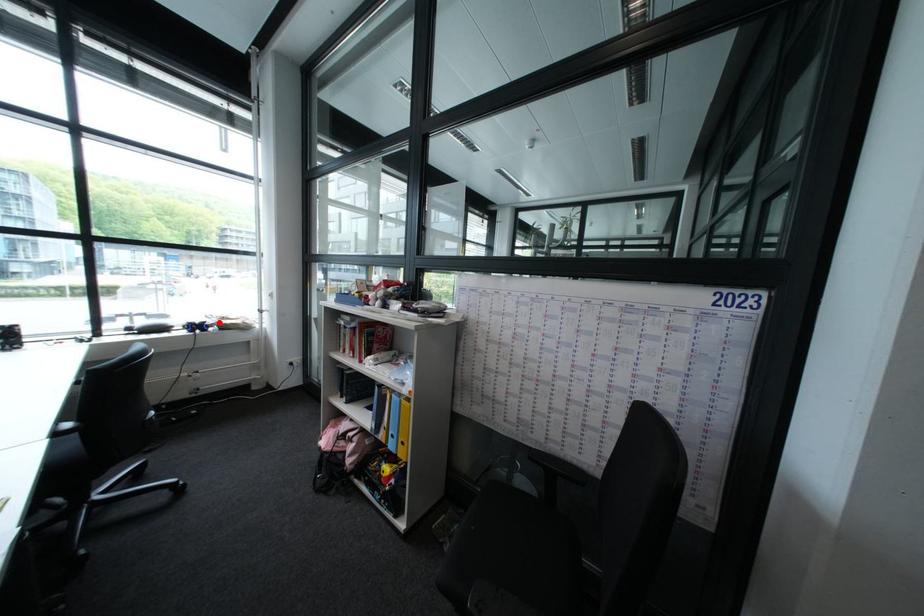
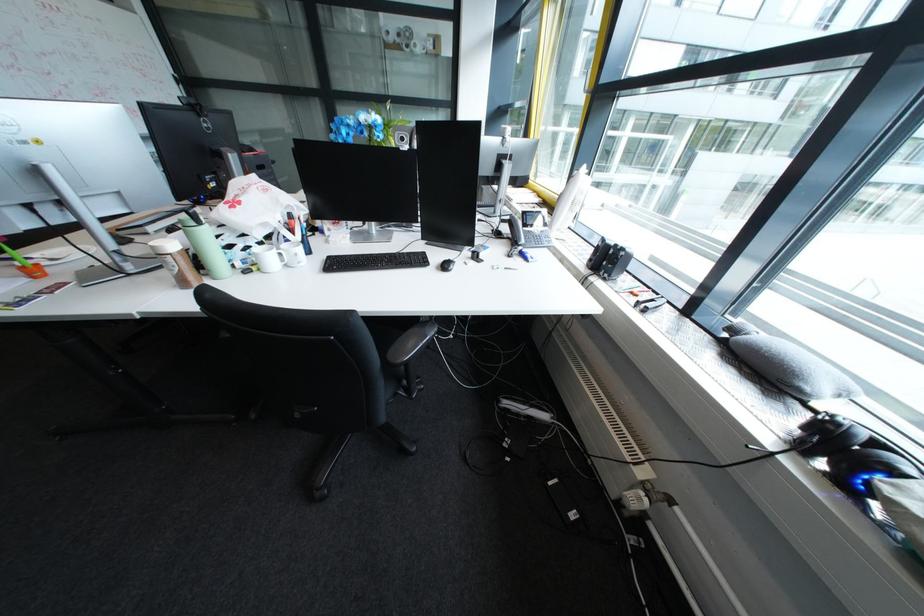
Where in the second image is the point corresponding to the highlighted location from the first image?

(909, 474)